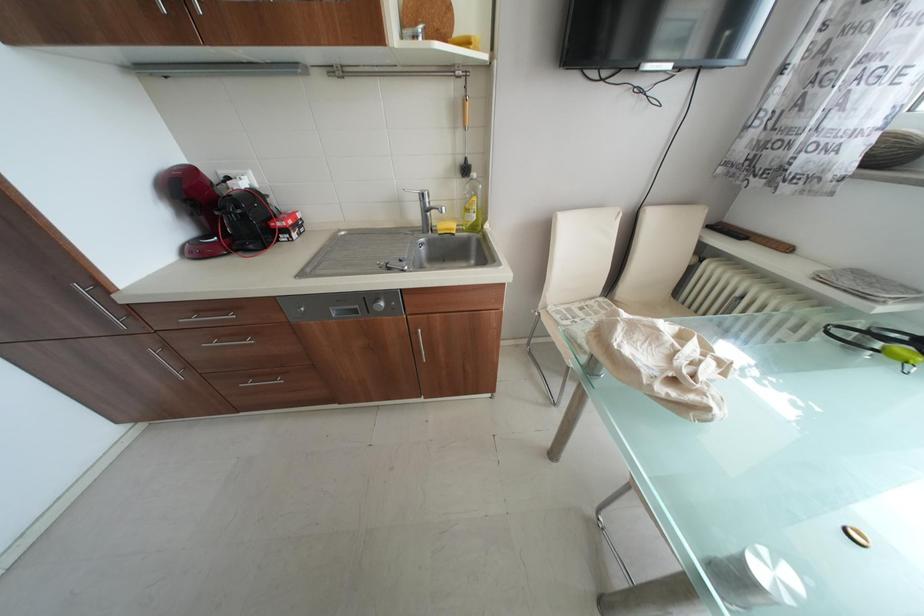
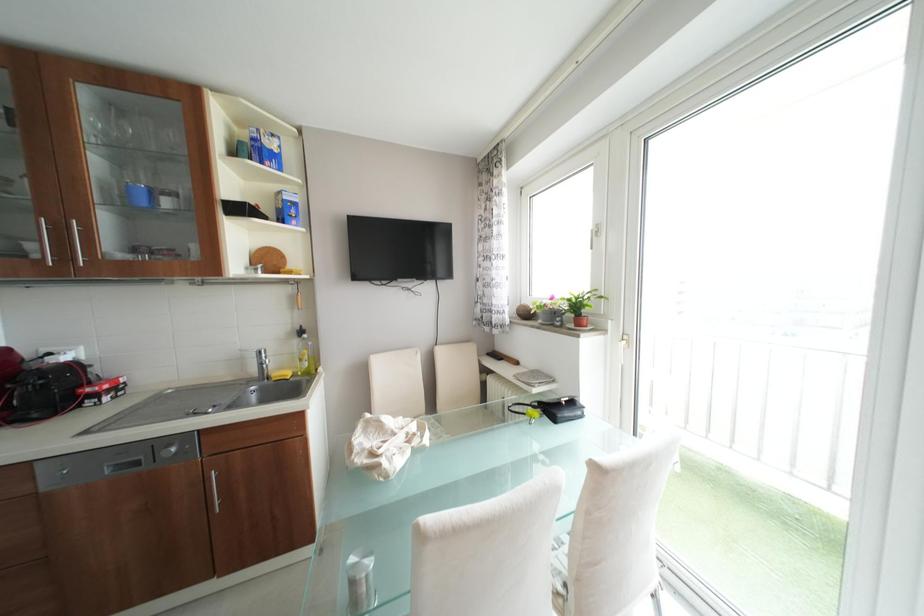
Based on the continuous images, in which direction is the camera rotating?

The camera rotated toward right-up.